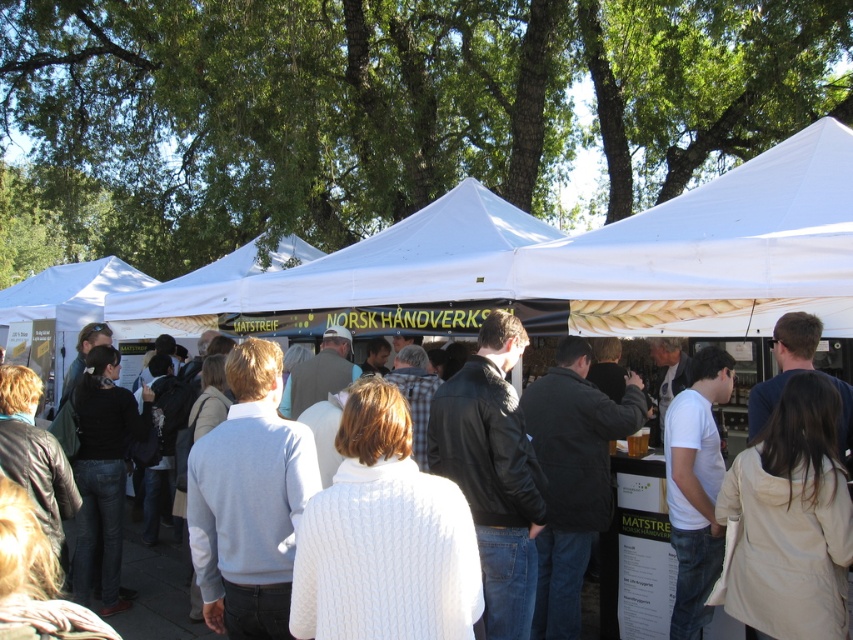
Question: Does white fabric canopy at upper center appear on the left side of white sweater at center?

Choices:
 (A) yes
 (B) no

Answer: (B)

Question: Can you confirm if white fabric canopy at upper center is positioned below white sweater at center?

Choices:
 (A) yes
 (B) no

Answer: (B)

Question: Which of the following is the closest to the observer?

Choices:
 (A) white sweater at center
 (B) white fabric canopy at upper center

Answer: (B)

Question: Is white fabric canopy at upper center thinner than white sweater at center?

Choices:
 (A) yes
 (B) no

Answer: (B)